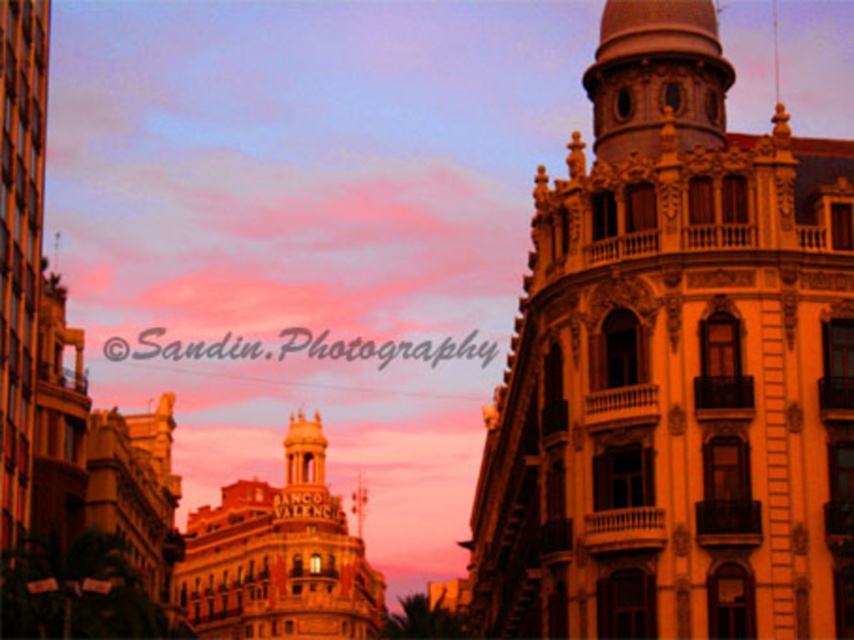
Which is above, golden stone tower at center or gold textured building at center?

Positioned higher is golden stone tower at center.

What do you see at coordinates (674, 365) in the screenshot?
I see `golden stone tower at center` at bounding box center [674, 365].

Between point (683, 404) and point (294, 570), which one is positioned behind?

Point (294, 570)

I want to click on golden stone tower at center, so click(674, 365).